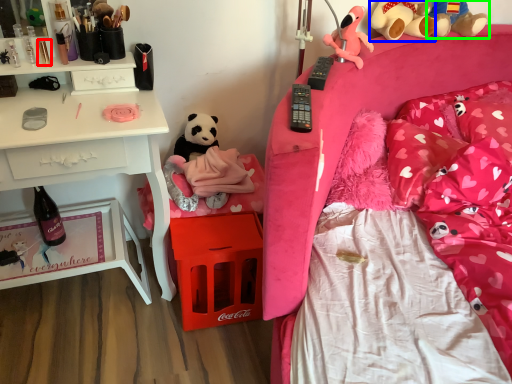
Question: Based on their relative distances, which object is nearer to toiletry (highlighted by a red box)? Choose from teddy bear (highlighted by a blue box) and toy (highlighted by a green box).

Choices:
 (A) teddy bear
 (B) toy

Answer: (A)